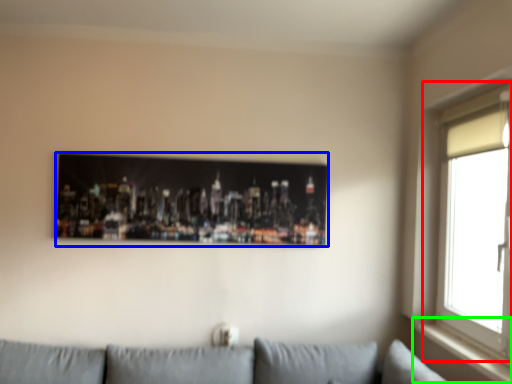
Question: Based on their relative distances, which object is farther from window (highlighted by a red box)? Choose from picture frame (highlighted by a blue box) and window sill (highlighted by a green box).

Choices:
 (A) picture frame
 (B) window sill

Answer: (A)